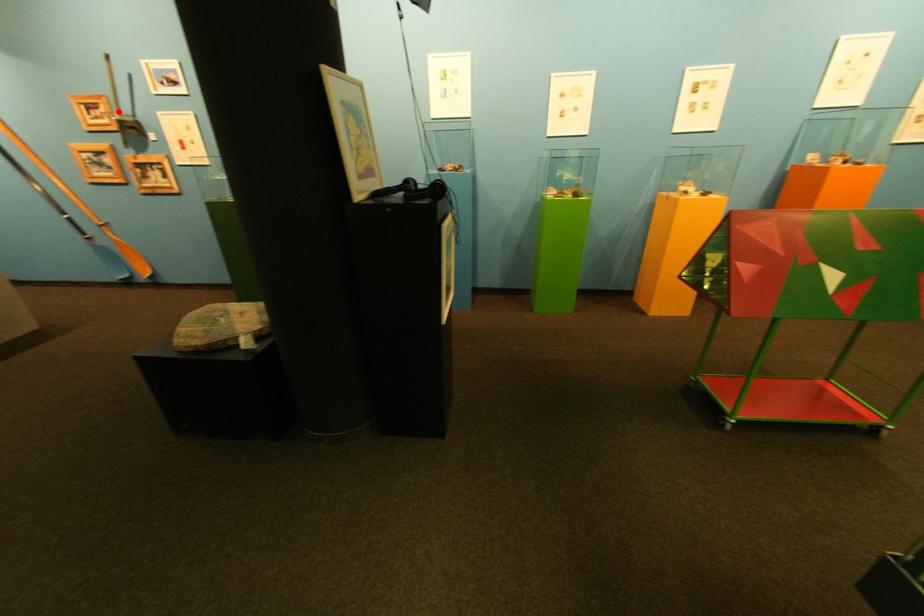
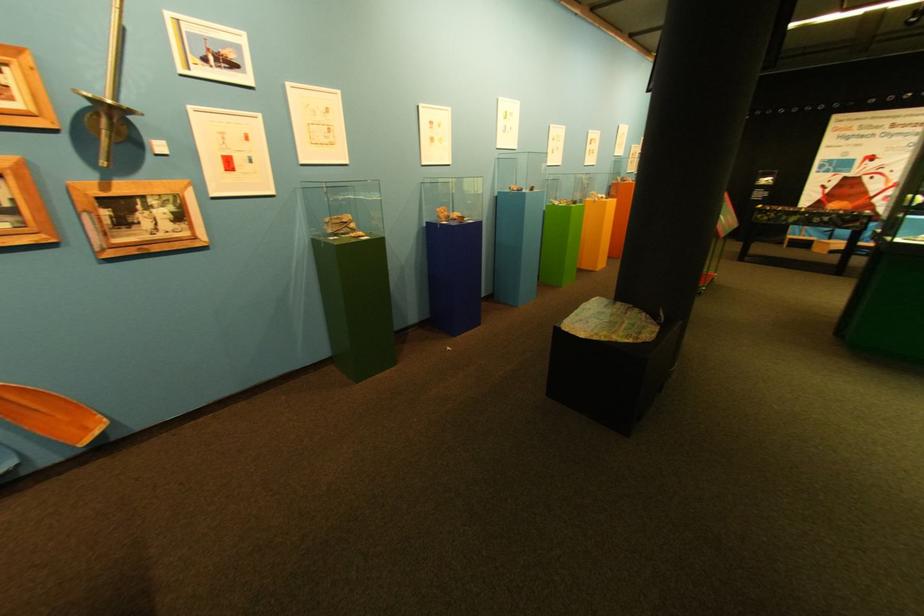
Question: A red point is marked in image1. In image2, is the corresponding 3D point closer to the camera or farther? Reply with the corresponding letter.

Choices:
 (A) The corresponding 3D point is closer.
 (B) The corresponding 3D point is farther.

Answer: (A)